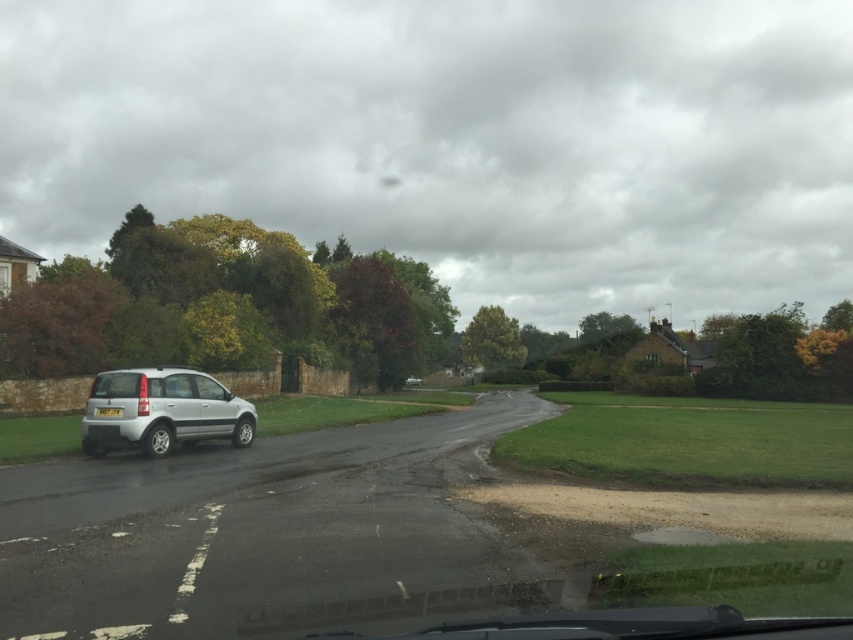
Is point (202, 378) positioned behind point (111, 406)?

That is True.

In order to click on silver metallic car at left in this screenshot , I will do [161, 412].

Find the location of a particular element. silver metallic car at left is located at coordinates (161, 412).